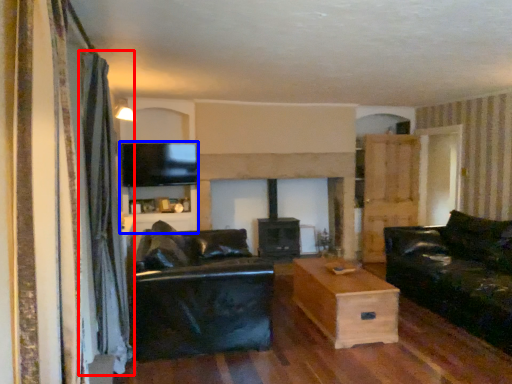
Question: Which point is closer to the camera, curtain (highlighted by a red box) or entertainment center (highlighted by a blue box)?

Choices:
 (A) curtain
 (B) entertainment center

Answer: (A)